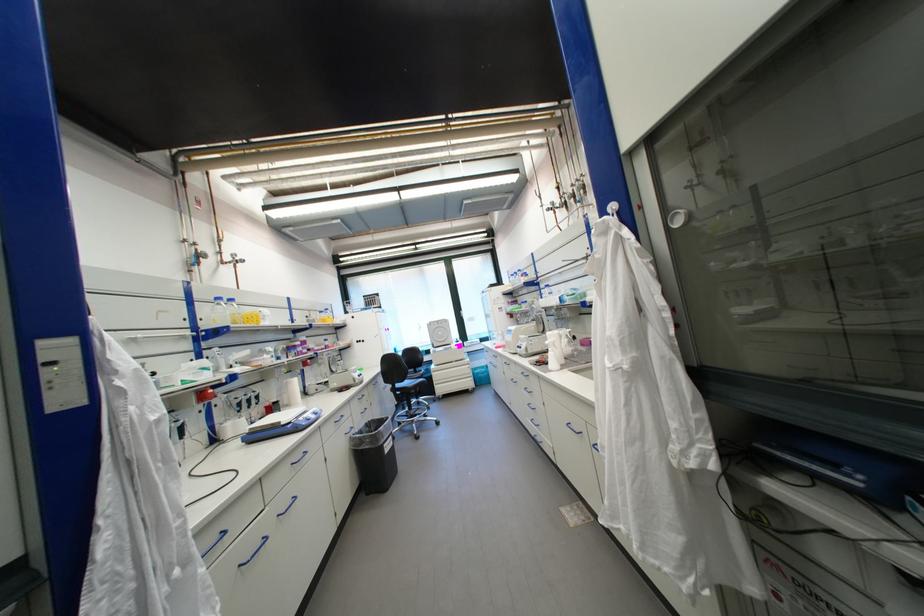
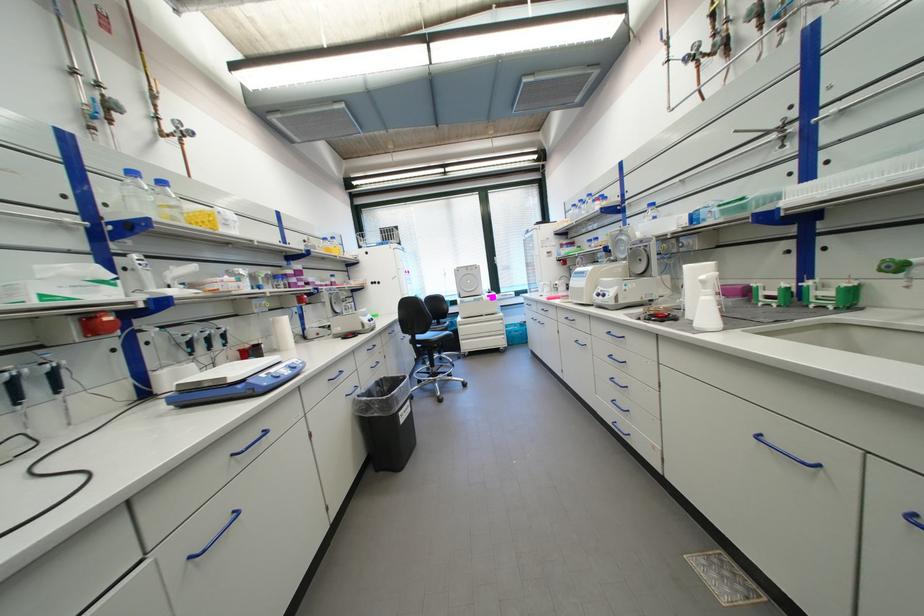
Question: What movement of the cameraman would produce the second image?

Choices:
 (A) Left
 (B) Right
 (C) Forward
 (D) Backward

Answer: (C)